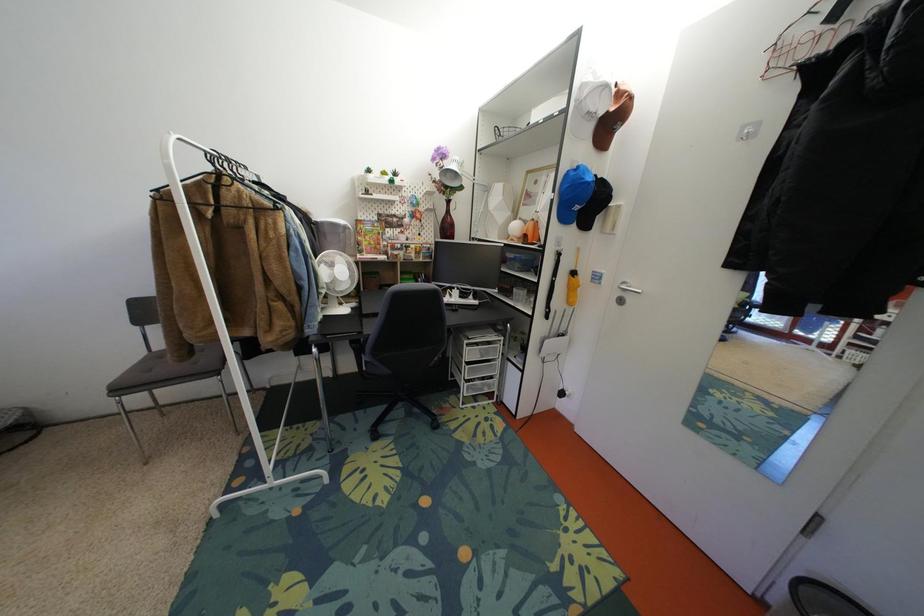
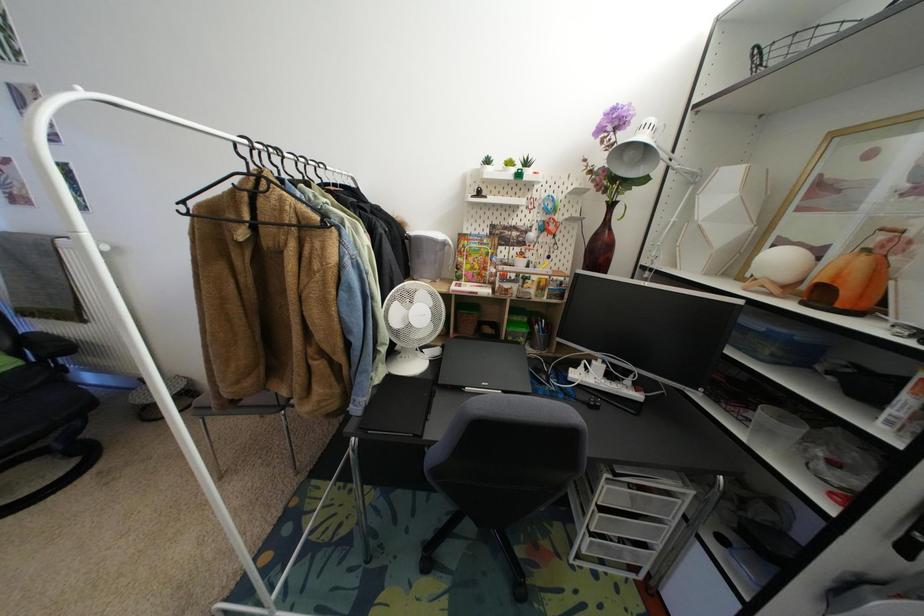
Question: The images are taken continuously from a first-person perspective. In which direction are you moving?

Choices:
 (A) Left
 (B) Right
 (C) Forward
 (D) Backward

Answer: (C)